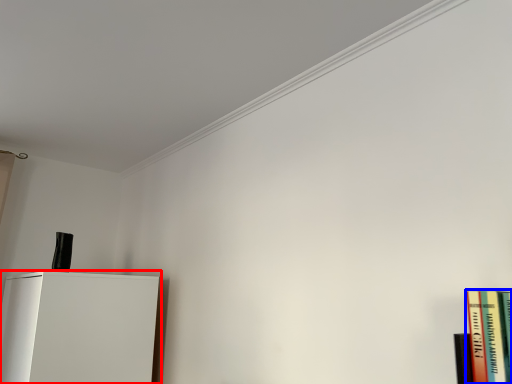
Question: Among these objects, which one is farthest to the camera, furniture (highlighted by a red box) or book (highlighted by a blue box)?

Choices:
 (A) furniture
 (B) book

Answer: (A)